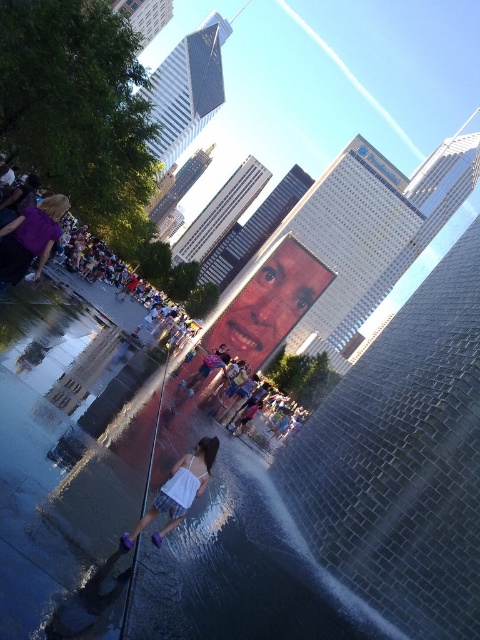
Question: Which of the following is the farthest from the observer?

Choices:
 (A) white fabric dress at lower center
 (B) matte purple dress at left

Answer: (B)

Question: Which point is closer to the camera taking this photo?

Choices:
 (A) (35, 221)
 (B) (169, 493)

Answer: (B)

Question: Does matte purple dress at left appear on the right side of white fabric dress at lower center?

Choices:
 (A) no
 (B) yes

Answer: (A)

Question: Can you confirm if matte purple dress at left is positioned to the right of white fabric dress at lower center?

Choices:
 (A) no
 (B) yes

Answer: (A)

Question: Which object appears farthest from the camera in this image?

Choices:
 (A) matte purple dress at left
 (B) white fabric dress at lower center

Answer: (A)

Question: Does matte purple dress at left have a smaller size compared to white fabric dress at lower center?

Choices:
 (A) yes
 (B) no

Answer: (A)